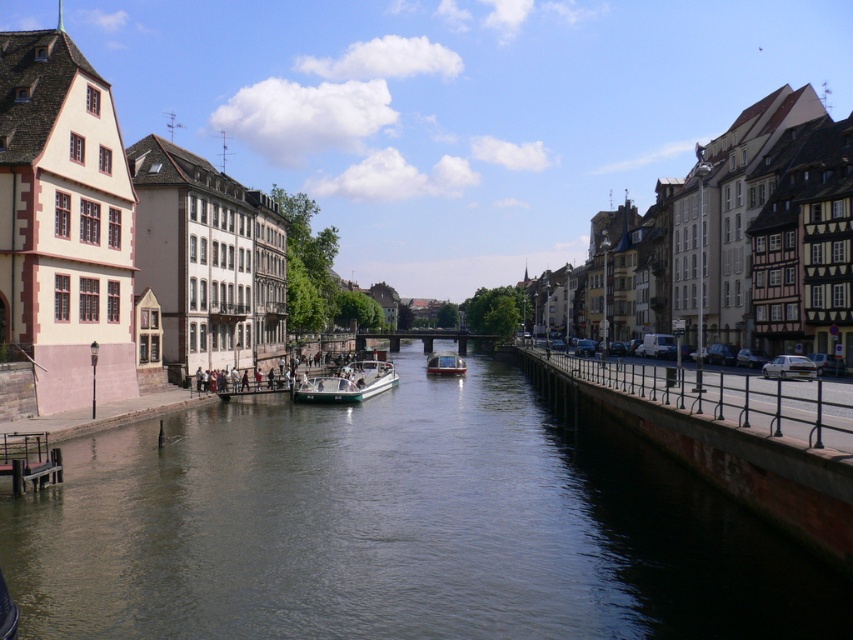
What do you see at coordinates (347, 384) in the screenshot?
I see `green matte boat at center` at bounding box center [347, 384].

Does green matte boat at center have a greater height compared to metallic polished boat at center?

No, green matte boat at center is not taller than metallic polished boat at center.

Is point (352, 372) farther from camera compared to point (460, 369)?

No, (352, 372) is in front of (460, 369).

Locate an element on the screen. green matte boat at center is located at coordinates (347, 384).

Who is more forward, (x=42, y=545) or (x=426, y=362)?

Point (x=42, y=545) is more forward.

Is point (283, 410) positioned in front of point (437, 369)?

Yes, it is in front of point (437, 369).

This screenshot has width=853, height=640. Find the location of `greenish-gray water at center`. greenish-gray water at center is located at coordinates (399, 528).

Can you confirm if greenish-gray water at center is positioned to the left of green matte boat at center?

Incorrect, greenish-gray water at center is not on the left side of green matte boat at center.

Locate an element on the screen. The width and height of the screenshot is (853, 640). greenish-gray water at center is located at coordinates (399, 528).

Does point (428, 404) come in front of point (343, 390)?

No, it is behind (343, 390).

Locate an element on the screen. greenish-gray water at center is located at coordinates (399, 528).